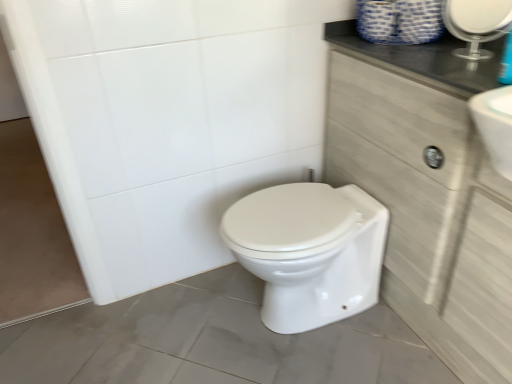
Question: Considering the relative sizes of clear glass mirror at upper right and white glossy bidet at center in the image provided, is clear glass mirror at upper right smaller than white glossy bidet at center?

Choices:
 (A) no
 (B) yes

Answer: (B)

Question: Is clear glass mirror at upper right closer to camera compared to white glossy bidet at center?

Choices:
 (A) yes
 (B) no

Answer: (A)

Question: Is clear glass mirror at upper right facing towards white glossy bidet at center?

Choices:
 (A) yes
 (B) no

Answer: (B)

Question: From a real-world perspective, is clear glass mirror at upper right located beneath white glossy bidet at center?

Choices:
 (A) yes
 (B) no

Answer: (B)

Question: Can you confirm if clear glass mirror at upper right is wider than white glossy bidet at center?

Choices:
 (A) no
 (B) yes

Answer: (A)

Question: Is light wood cabinet at right taller or shorter than white glossy bidet at center?

Choices:
 (A) tall
 (B) short

Answer: (A)

Question: Choose the correct answer: Is light wood cabinet at right inside white glossy bidet at center or outside it?

Choices:
 (A) outside
 (B) inside

Answer: (A)

Question: In terms of size, does light wood cabinet at right appear bigger or smaller than white glossy bidet at center?

Choices:
 (A) small
 (B) big

Answer: (B)

Question: From a real-world perspective, relative to white glossy bidet at center, is light wood cabinet at right vertically above or below?

Choices:
 (A) above
 (B) below

Answer: (A)

Question: Is clear glass mirror at upper right wider or thinner than light wood cabinet at right?

Choices:
 (A) thin
 (B) wide

Answer: (A)

Question: From a real-world perspective, is clear glass mirror at upper right above or below light wood cabinet at right?

Choices:
 (A) below
 (B) above

Answer: (B)

Question: Is clear glass mirror at upper right bigger or smaller than light wood cabinet at right?

Choices:
 (A) small
 (B) big

Answer: (A)

Question: Considering the positions of clear glass mirror at upper right and light wood cabinet at right in the image, is clear glass mirror at upper right taller or shorter than light wood cabinet at right?

Choices:
 (A) tall
 (B) short

Answer: (B)

Question: From a real-world perspective, relative to light wood cabinet at right, is white glossy bidet at center vertically above or below?

Choices:
 (A) below
 (B) above

Answer: (A)

Question: Based on their sizes in the image, would you say white glossy bidet at center is bigger or smaller than light wood cabinet at right?

Choices:
 (A) big
 (B) small

Answer: (B)